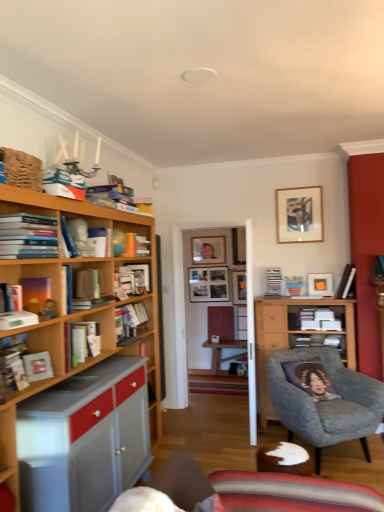
Question: Considering the positions of matte white picture frame at upper right, placed as the first picture frame when sorted from front to back, and matte black picture frame at upper center, positioned as the fourth picture frame in front-to-back order, in the image, is matte white picture frame at upper right, placed as the first picture frame when sorted from front to back, taller or shorter than matte black picture frame at upper center, positioned as the fourth picture frame in front-to-back order,?

Choices:
 (A) short
 (B) tall

Answer: (A)

Question: Visually, is matte white picture frame at upper right, placed as the first picture frame when sorted from front to back, positioned to the left or to the right of matte black picture frame at upper center, positioned as the fourth picture frame in front-to-back order?

Choices:
 (A) left
 (B) right

Answer: (B)

Question: Estimate the real-world distances between objects in this image. Which object is farther from the hardcover book at left, which is the 2th book from front to back?

Choices:
 (A) hardcover book at center, positioned as the 4th book in right-to-left order
 (B) hardcover books at left, positioned as the 1th book in front-to-back order
 (C) hardcover book at center, the 5th book viewed from the back
 (D) hardcover book at upper right, which appears as the 11th book when viewed from the front
 (E) matte white picture frame at upper right, which is the 4th picture frame in back-to-front order

Answer: (D)

Question: Which object is positioned closest to the black matte picture frame at center, placed as the third picture frame when sorted from front to back?

Choices:
 (A) matte brown book at left, which is the 7th book from back to front
 (B) hardcover book at left, which is the 2th book from front to back
 (C) wooden picture frame at upper right, which ranks as the second picture frame in front-to-back order
 (D) matte white book at left, which ranks as the eighth book in right-to-left order
 (E) hardcover book at center, the 10th book positioned from the front

Answer: (C)